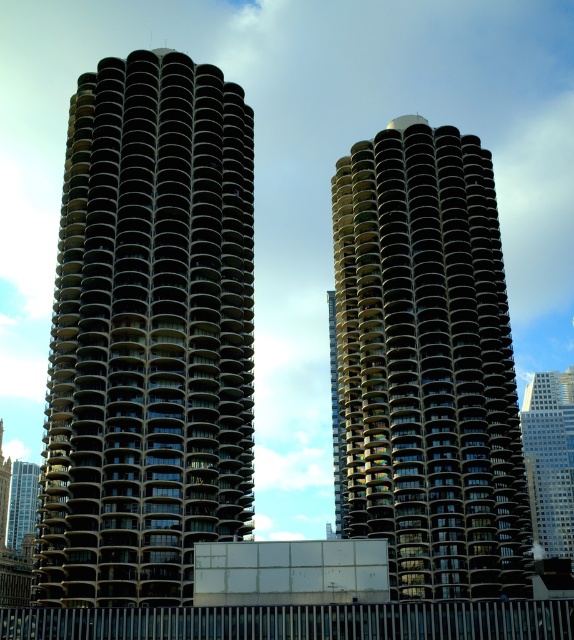
Who is positioned more to the left, dark gray concrete building at left or matte glass building at left?

From the viewer's perspective, matte glass building at left appears more on the left side.

Is dark gray concrete building at left taller than matte glass building at left?

Correct, dark gray concrete building at left is much taller as matte glass building at left.

Is point (121, 440) positioned behind point (7, 534)?

No, it is not.

This screenshot has height=640, width=574. What are the coordinates of `dark gray concrete building at left` in the screenshot? It's located at (149, 333).

Can you confirm if black glass building at center is positioned to the left of matte glass building at left?

Incorrect, black glass building at center is not on the left side of matte glass building at left.

How far apart are black glass building at center and matte glass building at left?

467.26 feet

Where is `black glass building at center`? The width and height of the screenshot is (574, 640). black glass building at center is located at coordinates (428, 364).

Does black glass building at center have a larger size compared to glassy reflective skyscraper at right?

Incorrect, black glass building at center is not larger than glassy reflective skyscraper at right.

Who is more forward, [375,182] or [549,484]?

Point [375,182] is more forward.

Locate an element on the screen. This screenshot has height=640, width=574. black glass building at center is located at coordinates (428, 364).